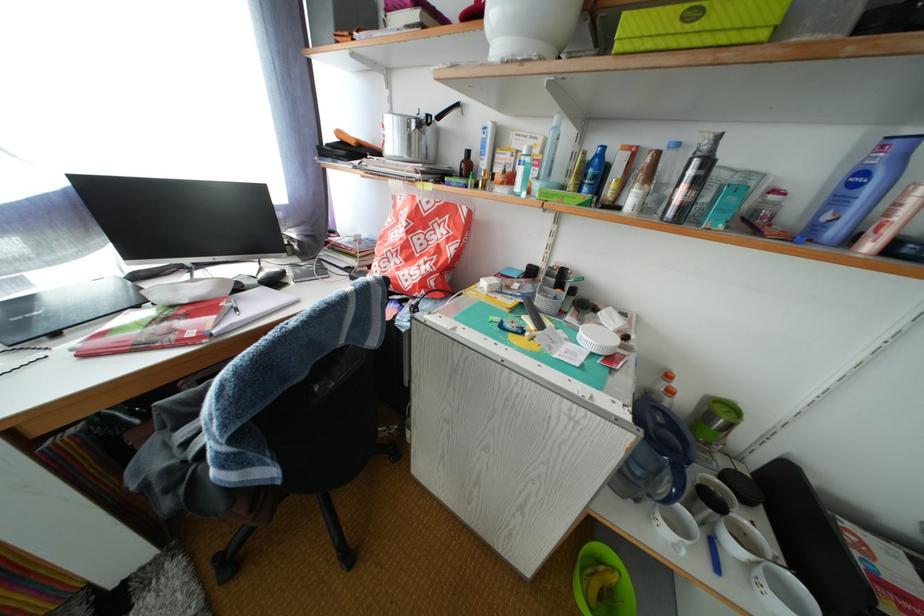
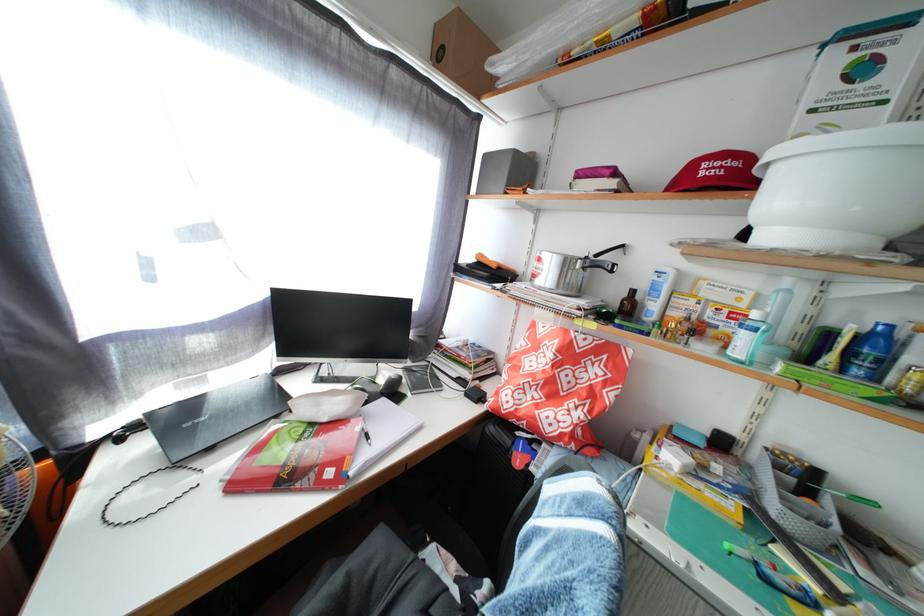
Where in the second image is the point corresponding to point 200,339 from the first image?

(338, 480)